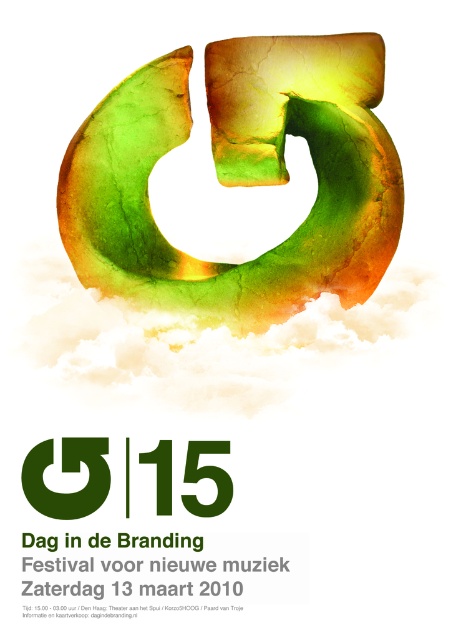
You are standing 1.5 meters away from the poster. Can you see the point at coordinates point (x=381, y=193) clearly from your current position?

The distance of point (x=381, y=193) from camera is 1.25 meters, so you are 1.5 meters away from the poster. Since the point is closer than your position, you cannot see it clearly from your current position.

You are looking at the promotional poster for the event. There is a green matte circle at center and a green matte number at center. Which object is positioned higher on the poster?

The green matte circle at center is located above the green matte number at center, so it is positioned higher on the poster.